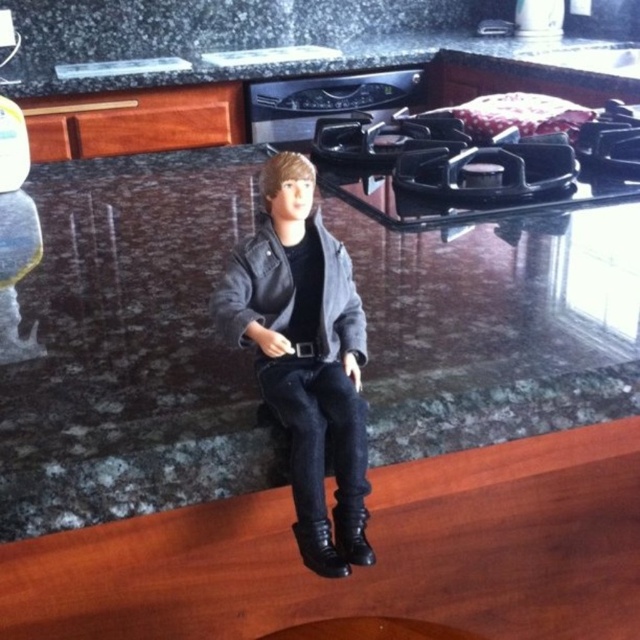
You are a delivery person who just arrived at the kitchen. You need to place a package on the granite countertop at upper center. Where exactly should you place it?

The granite countertop at upper center is located at point (300,42), so place the package there.

You are a chef preparing to place a 2.0 meter long cutting board on the granite countertop at upper center. The leather jacket at center is currently in the way. Can you fit the cutting board on the countertop without moving the jacket?

The granite countertop at upper center is 1.97 meters from the leather jacket at center. Since the cutting board is 2.0 meters long, it cannot fit entirely on the countertop without overlapping the jacket.